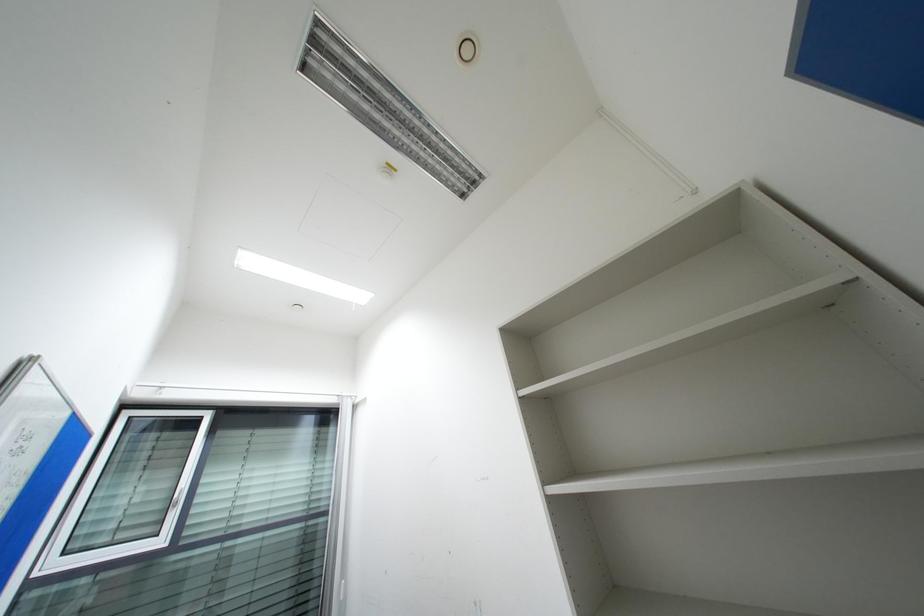
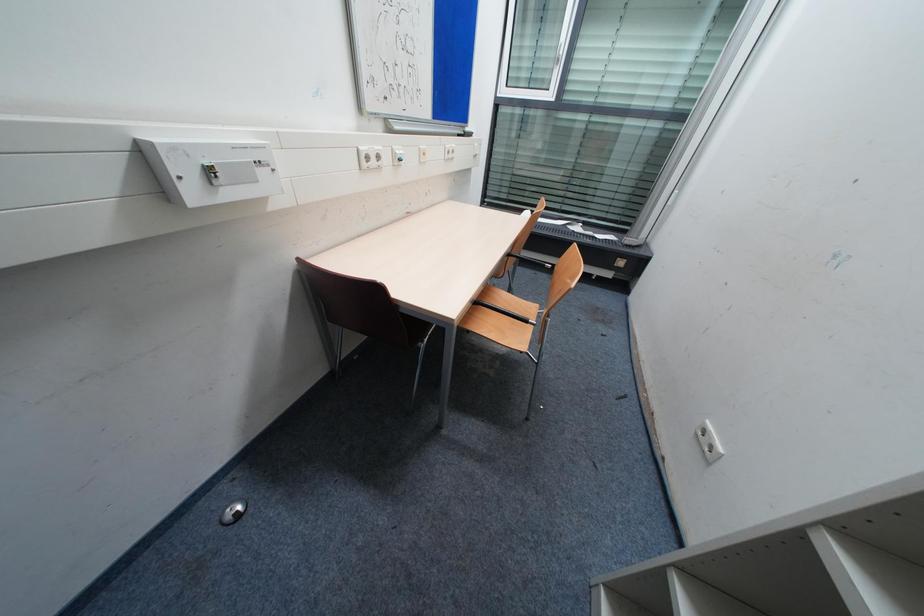
First-person continuous shooting, in which direction is the camera rotating?

The rotation direction of the camera is left-down.